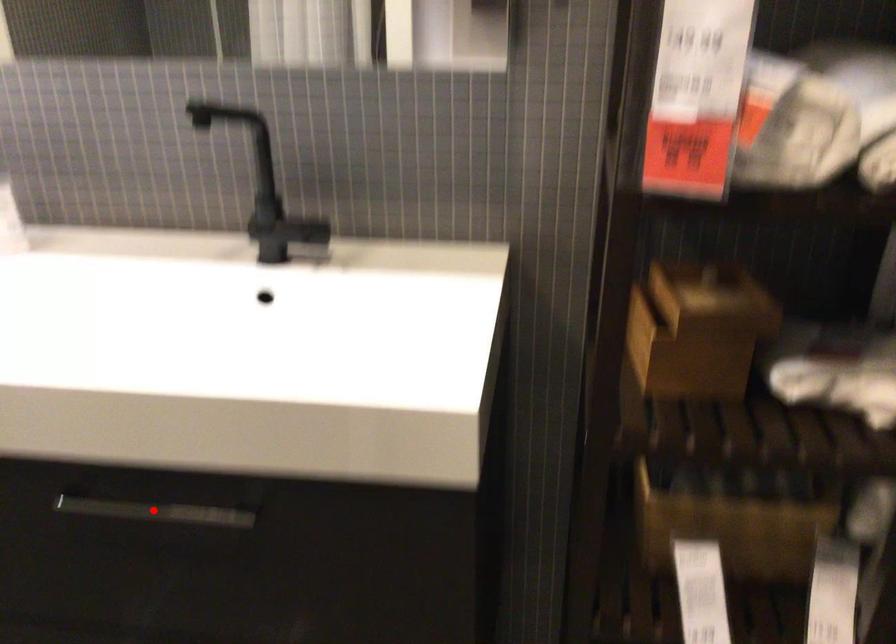
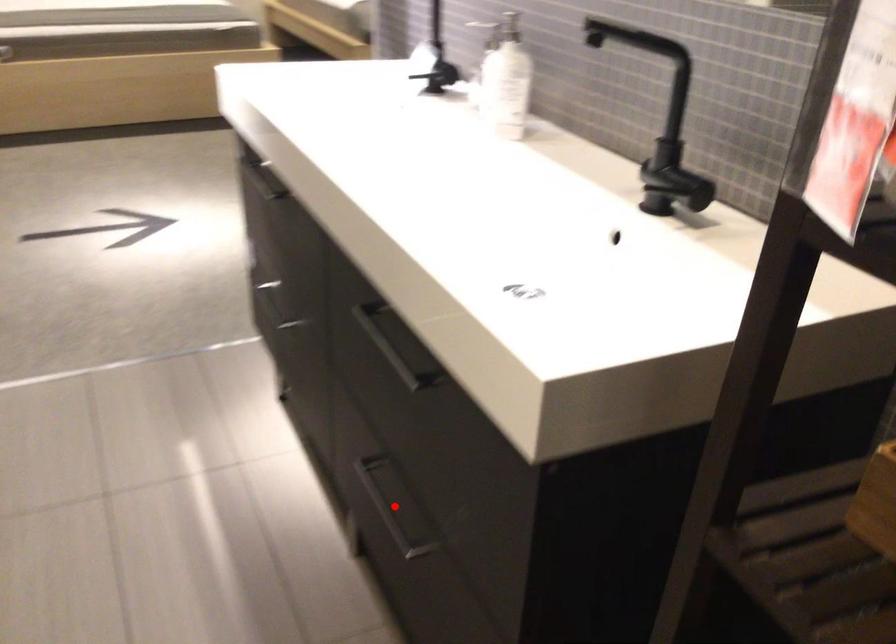
I am providing you with two images of the same scene from different viewpoints. A red point is marked on the first image and another point is marked on the second image. Is the red point in image1 aligned with the point shown in image2?

No